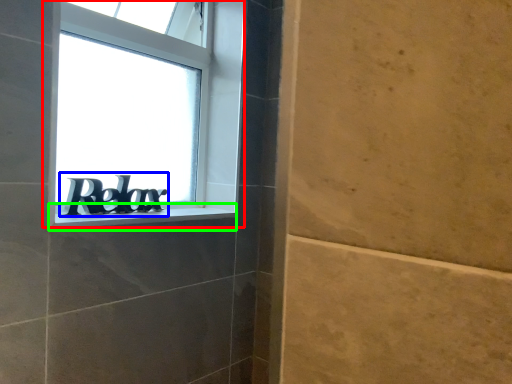
Question: Estimate the real-world distances between objects in this image. Which object is farther from window (highlighted by a red box), number (highlighted by a blue box) or window sill (highlighted by a green box)?

Choices:
 (A) number
 (B) window sill

Answer: (B)